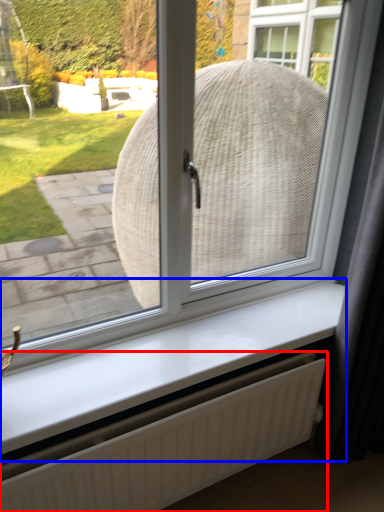
Question: Which of the following is the farthest to the observer, radiator (highlighted by a red box) or window sill (highlighted by a blue box)?

Choices:
 (A) radiator
 (B) window sill

Answer: (B)